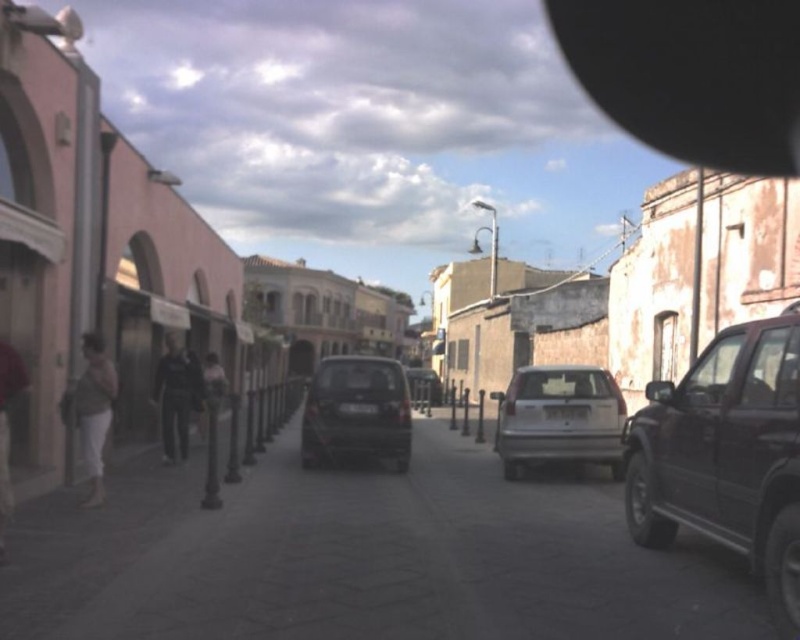
Question: Is shiny dark gray car at center wider than dark blue uniform at center?

Choices:
 (A) yes
 (B) no

Answer: (A)

Question: Is gray concrete pavement at center wider than dark gray suv at right?

Choices:
 (A) yes
 (B) no

Answer: (A)

Question: Which point is farther to the camera?

Choices:
 (A) dark blue uniform at center
 (B) light beige pants at lower left

Answer: (A)

Question: Is dark blue uniform at center to the right of matte gray pants at lower left from the viewer's perspective?

Choices:
 (A) yes
 (B) no

Answer: (B)

Question: Which is farther from the shiny dark gray car at center?

Choices:
 (A) silver metallic sedan at center
 (B) dark blue uniform at center
 (C) matte gray pants at lower left

Answer: (C)

Question: Estimate the real-world distances between objects in this image. Which object is farther from the dark blue uniform at center?

Choices:
 (A) matte gray pants at lower left
 (B) shiny dark gray car at center
 (C) dark gray suv at right
 (D) gray concrete pavement at center

Answer: (C)